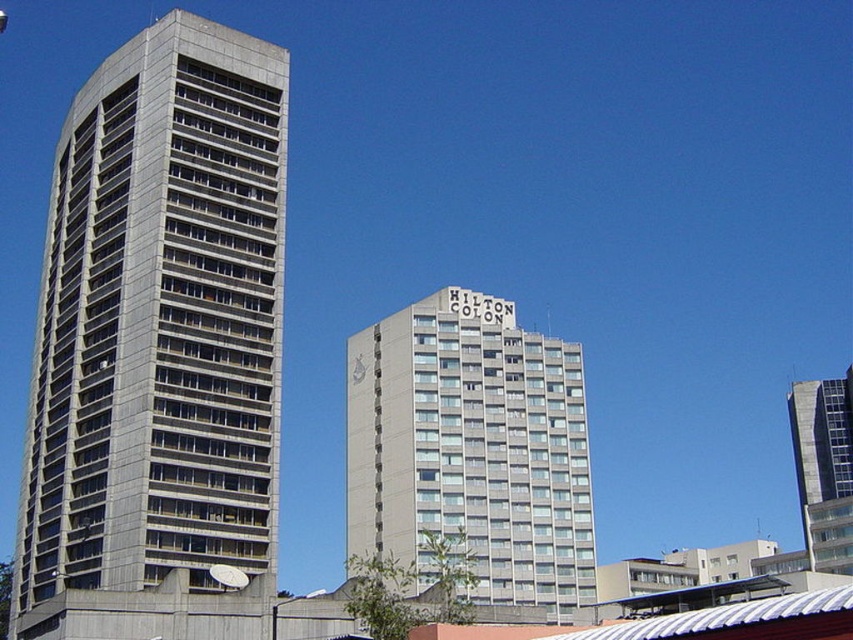
Question: Is gray metallic building at left bigger than gray concrete building at right?

Choices:
 (A) yes
 (B) no

Answer: (B)

Question: Estimate the real-world distances between objects in this image. Which object is closer to the gray concrete building at center?

Choices:
 (A) gray metallic building at left
 (B) gray concrete building at right

Answer: (A)

Question: Which object is closer to the camera taking this photo?

Choices:
 (A) gray concrete building at right
 (B) gray concrete building at center

Answer: (B)

Question: Can you confirm if gray metallic building at left is thinner than gray concrete building at right?

Choices:
 (A) no
 (B) yes

Answer: (B)

Question: Which object is positioned closest to the gray metallic building at left?

Choices:
 (A) gray concrete building at right
 (B) gray concrete building at center

Answer: (B)

Question: Is gray metallic building at left closer to the viewer compared to gray concrete building at right?

Choices:
 (A) yes
 (B) no

Answer: (A)